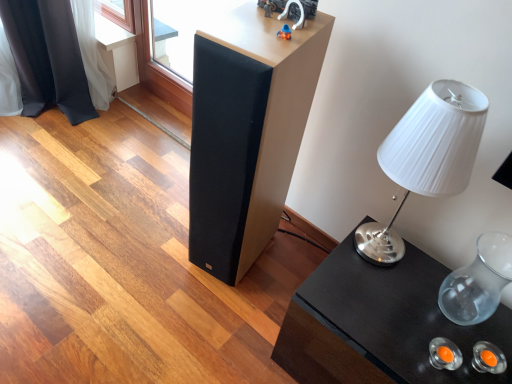
Question: Looking at their shapes, would you say matte black speaker at center is wider or thinner than transparent glass vase at right?

Choices:
 (A) wide
 (B) thin

Answer: (A)

Question: Would you say matte black speaker at center is to the left or to the right of transparent glass vase at right in the picture?

Choices:
 (A) right
 (B) left

Answer: (B)

Question: Which is nearer to the black glossy table at lower right?

Choices:
 (A) white pleated fabric lampshade at right
 (B) matte black speaker at center
 (C) transparent glass vase at right

Answer: (C)

Question: Which of these objects is positioned farthest from the white pleated fabric lampshade at right?

Choices:
 (A) transparent glass vase at right
 (B) black glossy table at lower right
 (C) matte black speaker at center

Answer: (A)